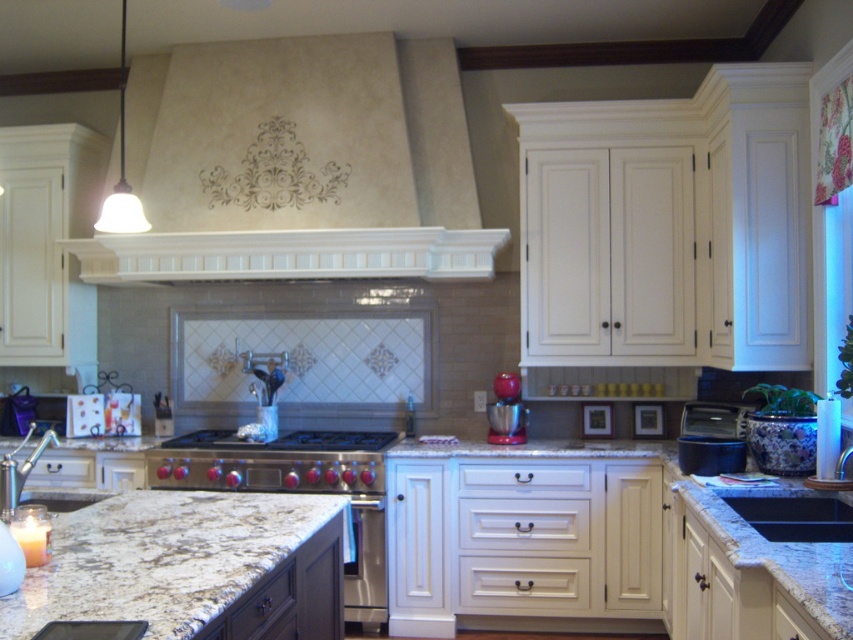
You are a kitchen designer planning to install a new appliance. You have a matte beige exhaust hood at upper center and a metallic red mixer at center. Which of these two objects occupies more space in the kitchen?

The matte beige exhaust hood at upper center is bigger than the metallic red mixer at center, so it occupies more space in the kitchen.

You are a chef preparing to place a large pot on the kitchen counter. You see the stainless steel stove at center and the metallic red mixer at center. Which object should you avoid placing the pot on because it is larger?

The stainless steel stove at center is bigger than the metallic red mixer at center, so you should avoid placing the pot on the stainless steel stove at center because it is larger and may not be suitable for holding the pot.